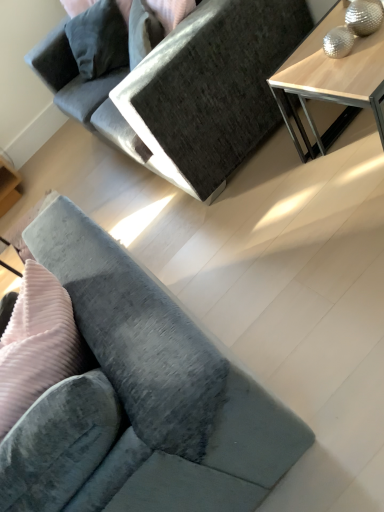
The height and width of the screenshot is (512, 384). Identify the location of vacant space that's between velvet gray couch at center, the 1th studio couch positioned from the top, and light wood table at upper right. (288, 173).